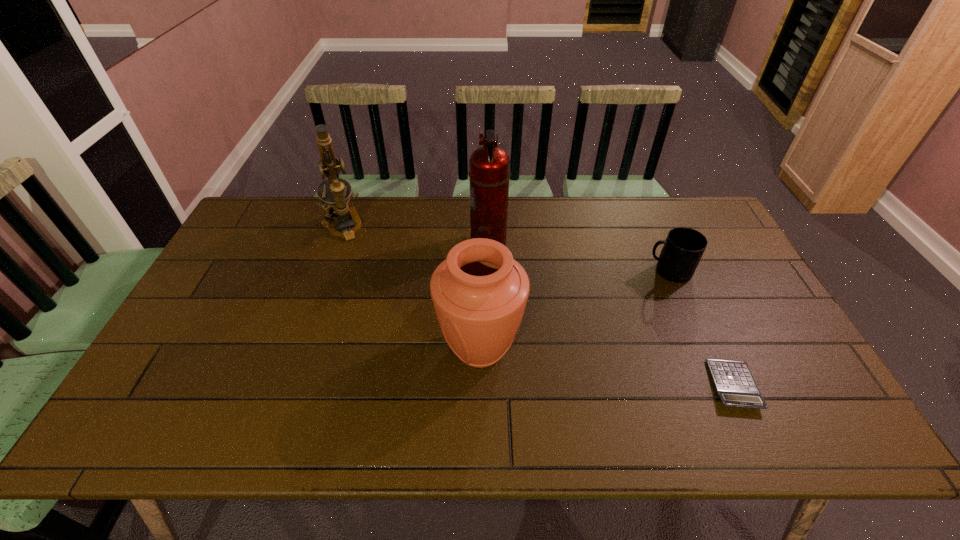
Locate an element on the screen. vacant space at the near edge of the desktop is located at coordinates (531, 430).

Find the location of a particular element. Image resolution: width=960 pixels, height=540 pixels. vacant space at the left edge is located at coordinates (247, 305).

This screenshot has width=960, height=540. What are the coordinates of `free region at the right edge of the desktop` in the screenshot? It's located at (740, 309).

In the image, there is a desktop. Identify the location of free space at the far left corner. This screenshot has width=960, height=540. (252, 208).

In the image, there is a desktop. Where is `free space at the far right corner`? free space at the far right corner is located at coordinates (707, 226).

Identify the location of vacant area that lies between the fourth tallest object and the calculator. The height and width of the screenshot is (540, 960). [x=701, y=328].

Find the location of `blank region between the microscope and the shortest object`. blank region between the microscope and the shortest object is located at coordinates click(538, 306).

Locate an element on the screen. This screenshot has width=960, height=540. free space between the vase and the microscope is located at coordinates (411, 288).

I want to click on free spot between the third shortest object and the calculator, so click(x=607, y=367).

The width and height of the screenshot is (960, 540). Find the location of `free area in between the fourth tallest object and the fire extinguisher`. free area in between the fourth tallest object and the fire extinguisher is located at coordinates (578, 258).